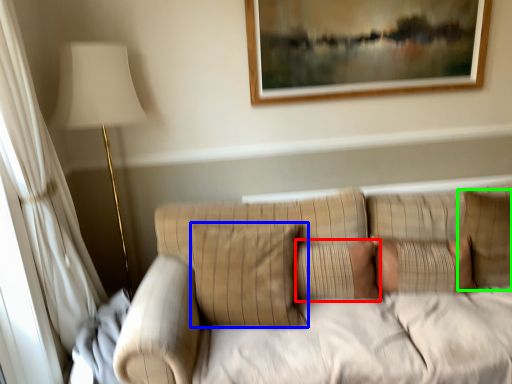
Question: Which object is positioned farthest from pillow (highlighted by a red box)? Select from pillow (highlighted by a blue box) and pillow (highlighted by a green box).

Choices:
 (A) pillow
 (B) pillow

Answer: (B)